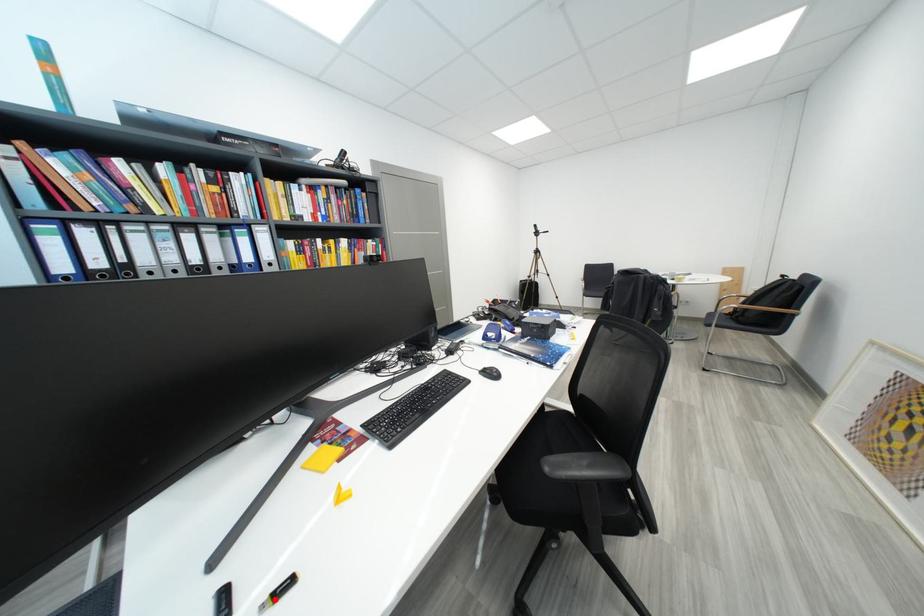
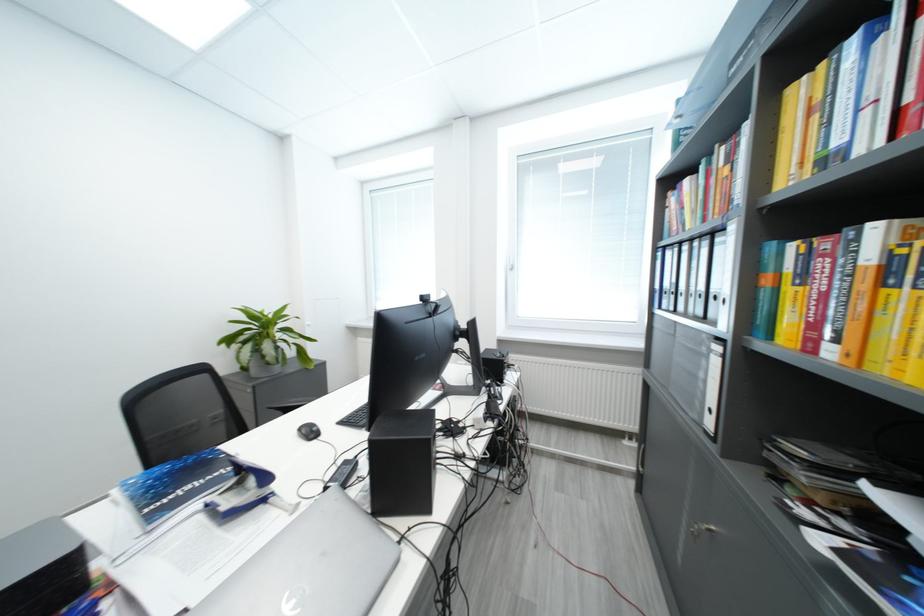
Question: I am providing you with two images of the same scene from different viewpoints. A red point is marked on the first image. Can you still see the location of the red point in image 2?

Choices:
 (A) Yes
 (B) No

Answer: (B)